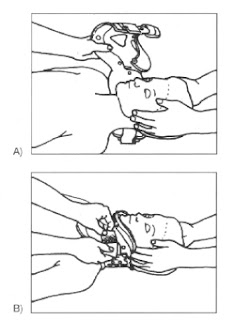
You are a GUI agent. You are given a task and a screenshot of the screen. Output one action in this format:
    pyautogui.click(x=<x>, y=<y>)
    Task: Click on the chest
    This screenshot has height=320, width=235.
    Given the screenshot: What is the action you would take?
    pyautogui.click(x=53, y=100), pyautogui.click(x=49, y=226)